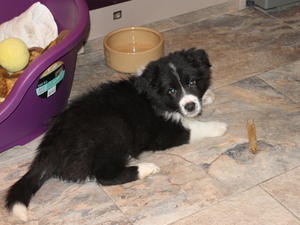
Locate an element on the screen. The width and height of the screenshot is (300, 225). sticker label is located at coordinates (53, 79).